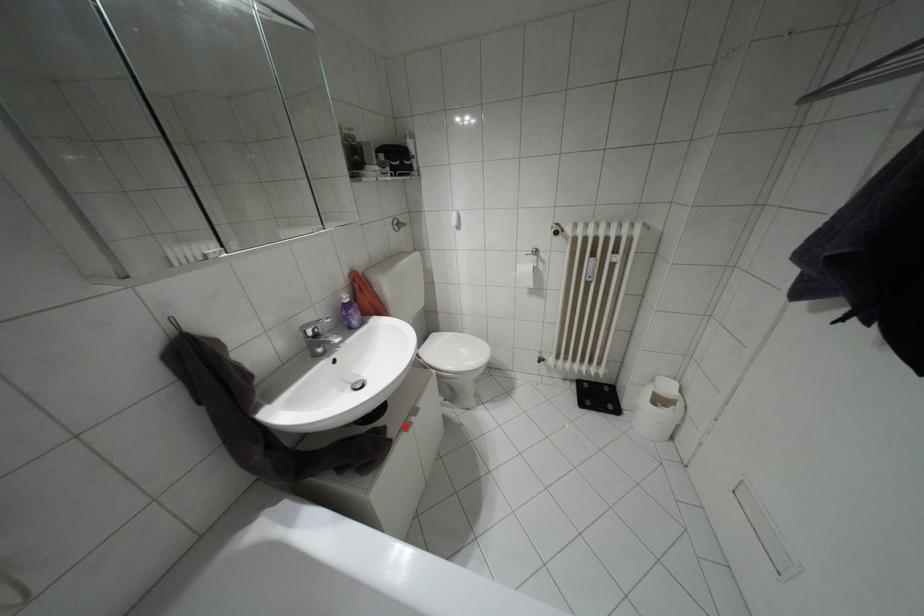
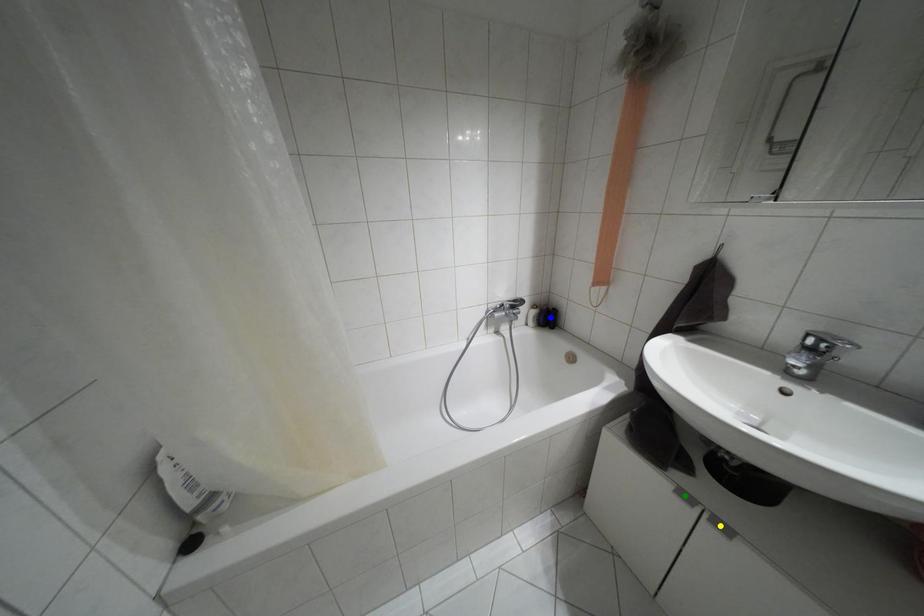
Question: I am providing you with two images of the same scene from different viewpoints. A red point is marked on the first image. You are given multiple points on the second image. Which spot in image 2 lines up with the point in image 1?

Choices:
 (A) green point
 (B) blue point
 (C) yellow point

Answer: (A)